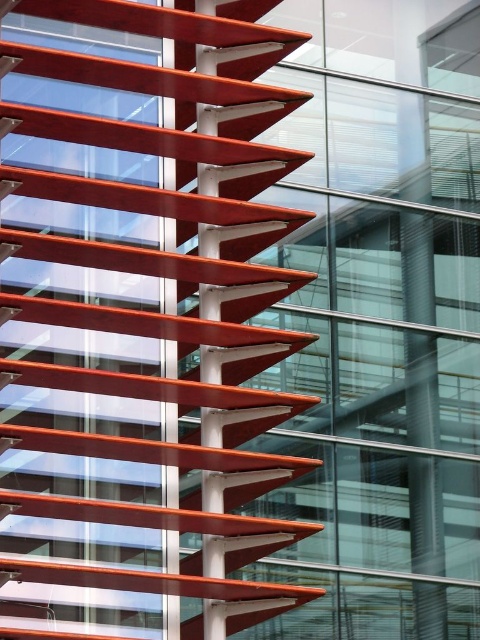
You are standing at the entrance of a modern building and see the matte red staircase at left and the metallic orange staircase at center. Which staircase is located higher up in the building?

The matte red staircase at left is positioned over the metallic orange staircase at center, so it is located higher up in the building.

You are standing in front of the modern building facade with red slats. You notice two points marked on the structure at coordinates point (20, 394) and point (200, 42). From your perspective, which point is closer to you?

Point (200, 42) is closer to you because point (20, 394) is behind it.

You are standing in a modern building and see the point at coordinates (142,321). What object is located at that point?

The point at coordinates (142,321) corresponds to the matte red staircase at left.